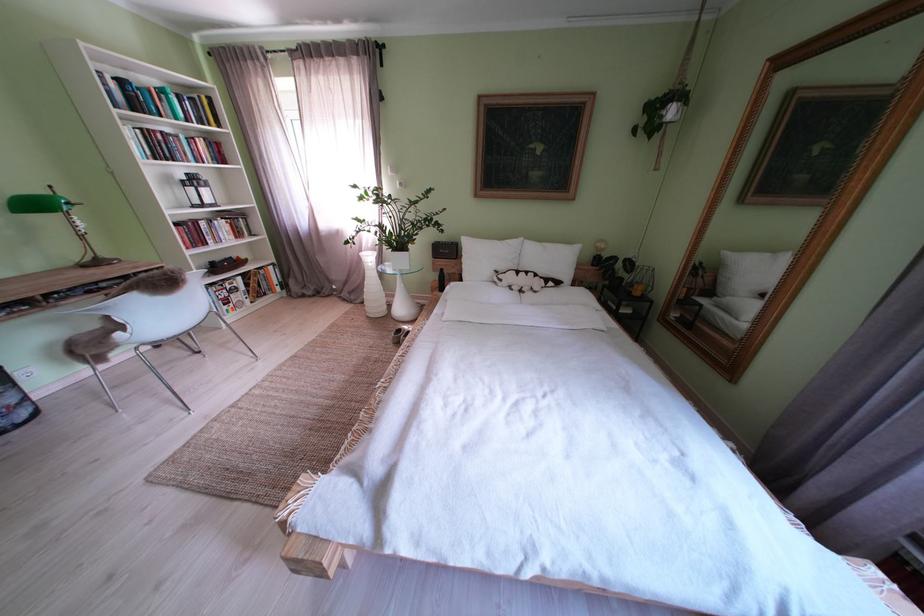
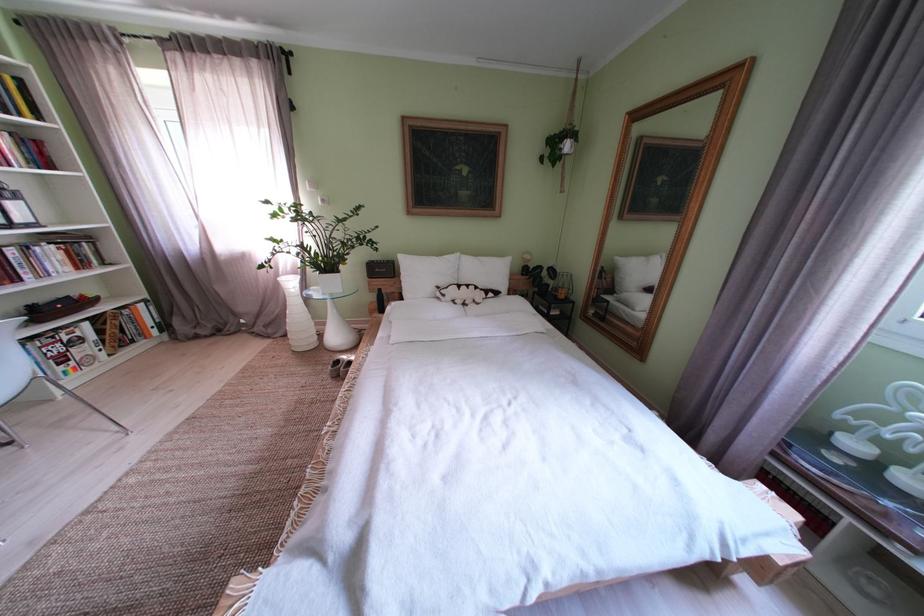
In the scene shown: Which direction would the cameraman need to move to produce the second image?

The cameraman moved toward left, forward.